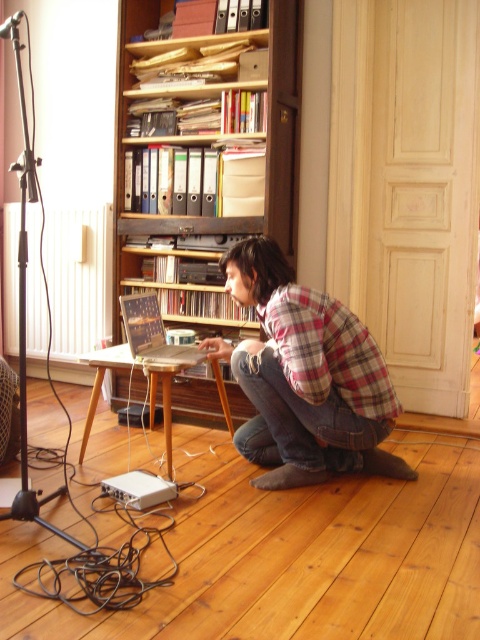
Is point (297, 336) less distant than point (169, 348)?

Yes.

Can you confirm if plaid flannel shirt at center is shorter than wooden laptop at center?

No.

Who is more distant from viewer, (264, 486) or (153, 358)?

The point (153, 358) is more distant.

Locate an element on the screen. plaid flannel shirt at center is located at coordinates (305, 378).

Is wooden bookshelf at upper center taller than wooden laptop at center?

Indeed, wooden bookshelf at upper center has a greater height compared to wooden laptop at center.

Is point (211, 300) positioned after point (128, 340)?

Yes, it is behind point (128, 340).

Where is `wooden bookshelf at upper center`? wooden bookshelf at upper center is located at coordinates (206, 148).

Can you confirm if wooden bookshelf at upper center is positioned to the left of plaid flannel shirt at center?

Indeed, wooden bookshelf at upper center is positioned on the left side of plaid flannel shirt at center.

Can you confirm if wooden bookshelf at upper center is taller than plaid flannel shirt at center?

Indeed, wooden bookshelf at upper center has a greater height compared to plaid flannel shirt at center.

At what (x,y) coordinates should I click in order to perform the action: click on wooden bookshelf at upper center. Please return your answer as a coordinate pair (x, y). The height and width of the screenshot is (640, 480). Looking at the image, I should click on (206, 148).